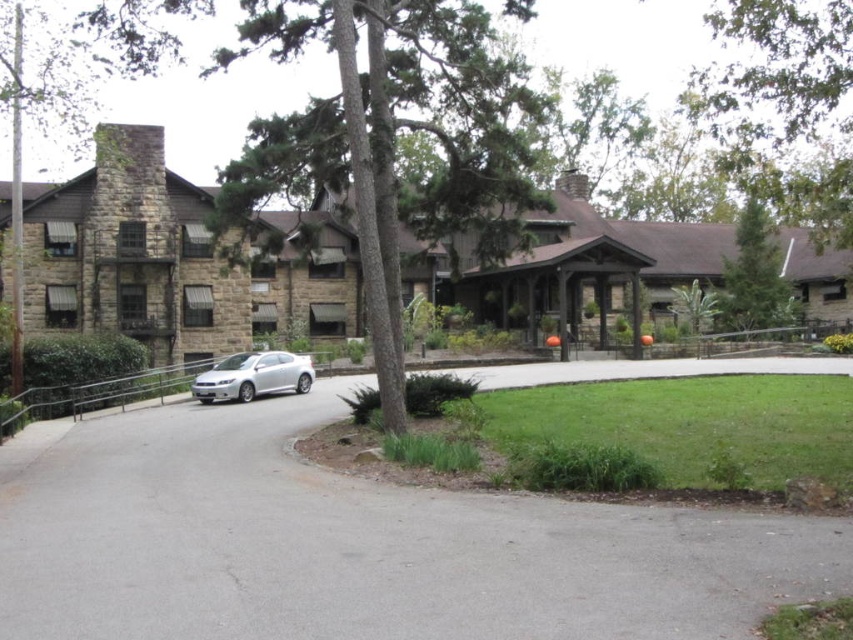
Is gray asphalt driveway at center bigger than green textured tree at center?

No, gray asphalt driveway at center is not bigger than green textured tree at center.

Is gray asphalt driveway at center positioned behind green textured tree at center?

No, gray asphalt driveway at center is closer to the viewer.

Between point (202, 442) and point (413, 12), which one is positioned in front?

Point (202, 442) is in front.

What are the coordinates of `gray asphalt driveway at center` in the screenshot? It's located at (358, 545).

Does green textured tree at center have a larger size compared to satin silver car at center?

Yes, green textured tree at center is bigger than satin silver car at center.

Is the position of green textured tree at center more distant than that of satin silver car at center?

No, green textured tree at center is closer to the viewer.

Which is in front, point (440, 132) or point (274, 380)?

Point (440, 132)

This screenshot has width=853, height=640. Find the location of `green textured tree at center`. green textured tree at center is located at coordinates (392, 140).

The image size is (853, 640). What do you see at coordinates (392, 140) in the screenshot?
I see `green textured tree at center` at bounding box center [392, 140].

Who is higher up, green textured tree at center or green leafy tree at upper right?

Positioned higher is green leafy tree at upper right.

Describe the element at coordinates (392, 140) in the screenshot. The image size is (853, 640). I see `green textured tree at center` at that location.

Locate an element on the screen. green textured tree at center is located at coordinates (392, 140).